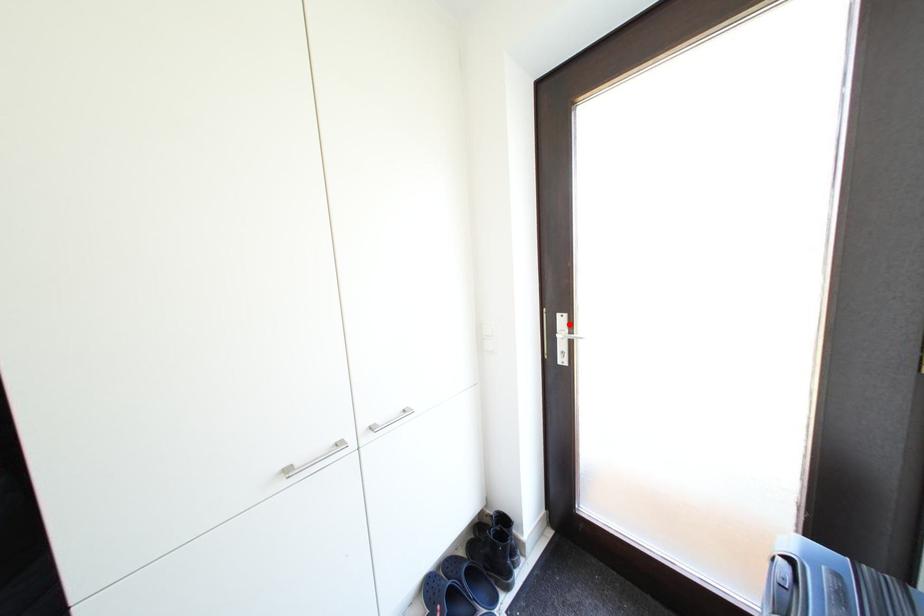
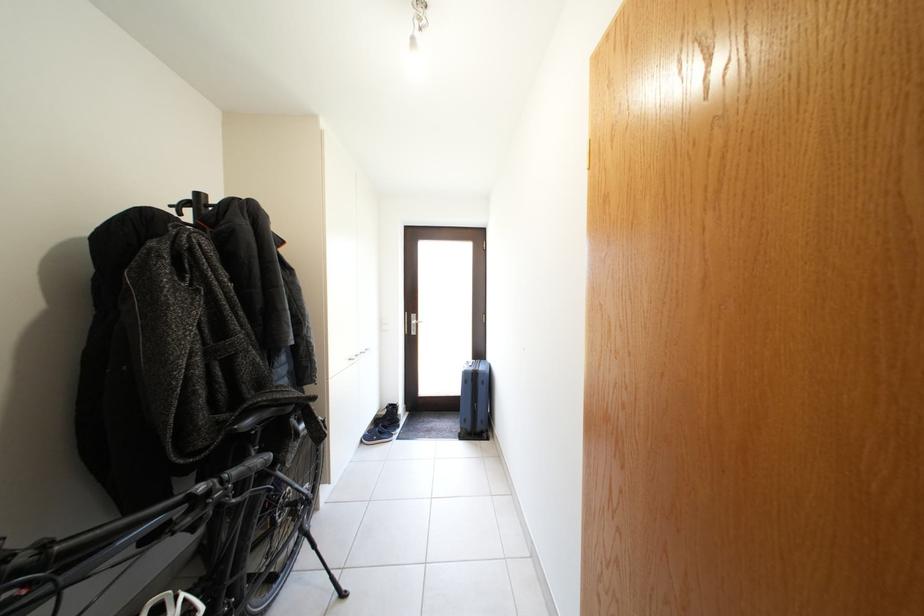
In the second image, find the point that corresponds to the highlighted location in the first image.

(421, 322)